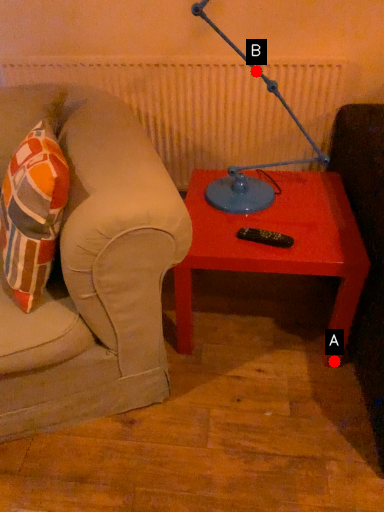
Question: Two points are circled on the image, labeled by A and B beside each circle. Which point is closer to the camera taking this photo?

Choices:
 (A) A is closer
 (B) B is closer

Answer: (B)